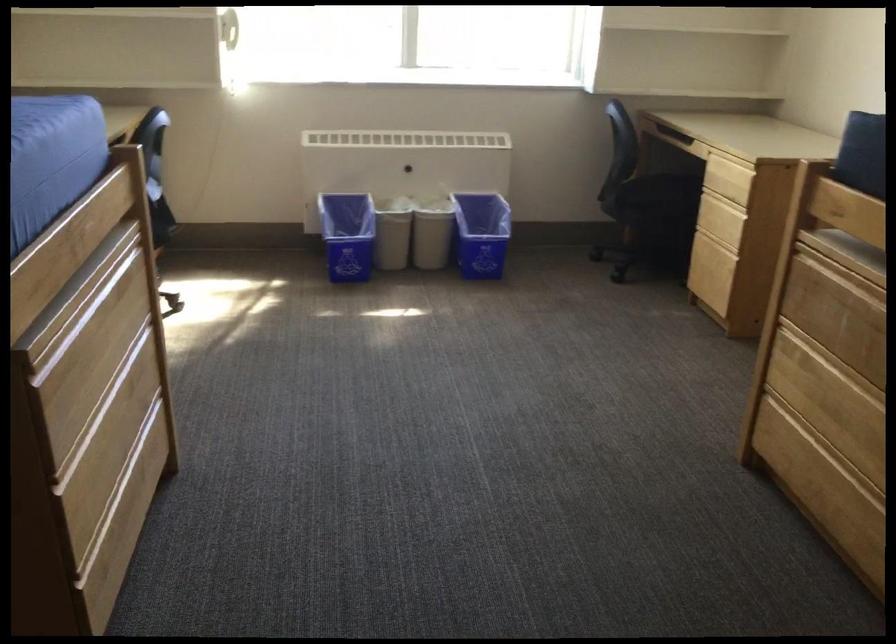
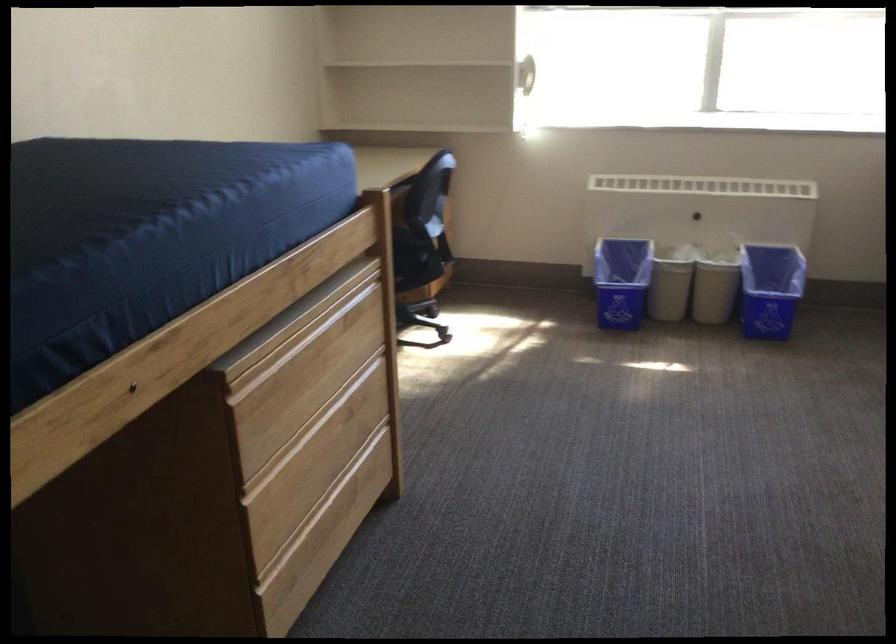
Find the pixel in the second image that matches point 100,412 in the first image.

(307, 431)